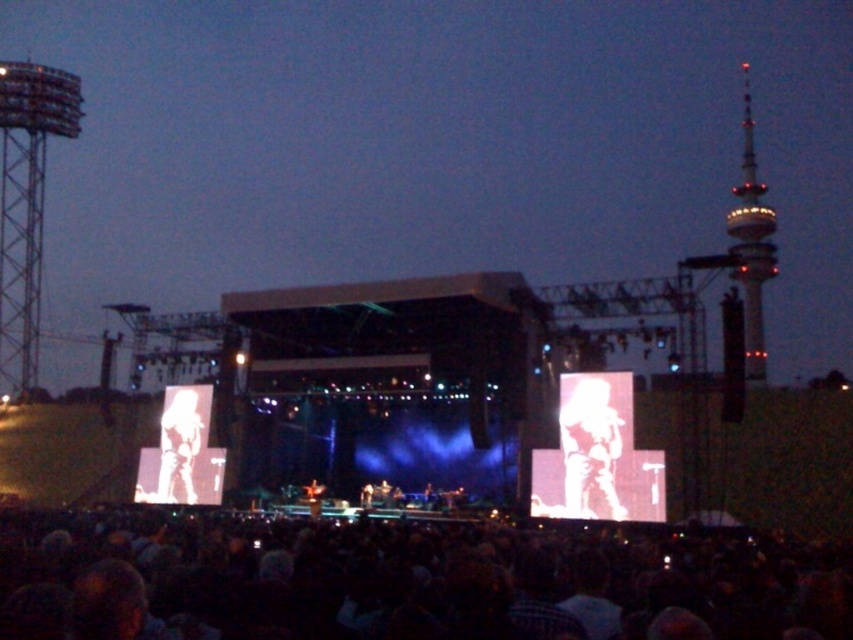
Does metallic tower at right come behind silhouette paper cutout at center?

No, it is not.

Does point (743, 68) lie in front of point (164, 444)?

No, it is not.

This screenshot has height=640, width=853. I want to click on metallic tower at right, so click(x=751, y=243).

Does point (334, 532) lie in front of point (9, 64)?

Yes.

Describe the element at coordinates (404, 579) in the screenshot. Image resolution: width=853 pixels, height=640 pixels. I see `dark matte crowd at lower center` at that location.

Identify the location of dark matte crowd at lower center. This screenshot has height=640, width=853. (404, 579).

Between dark matte crowd at lower center and metallic tower at right, which one is positioned lower?

dark matte crowd at lower center is lower down.

Is point (78, 595) farther from viewer compared to point (747, 296)?

No, (78, 595) is closer to viewer.

You are a GUI agent. You are given a task and a screenshot of the screen. Output one action in this format:
    pyautogui.click(x=<x>, y=<y>)
    Task: Click on the dark matte crowd at lower center
    The image size is (853, 640).
    Given the screenshot: What is the action you would take?
    tap(404, 579)